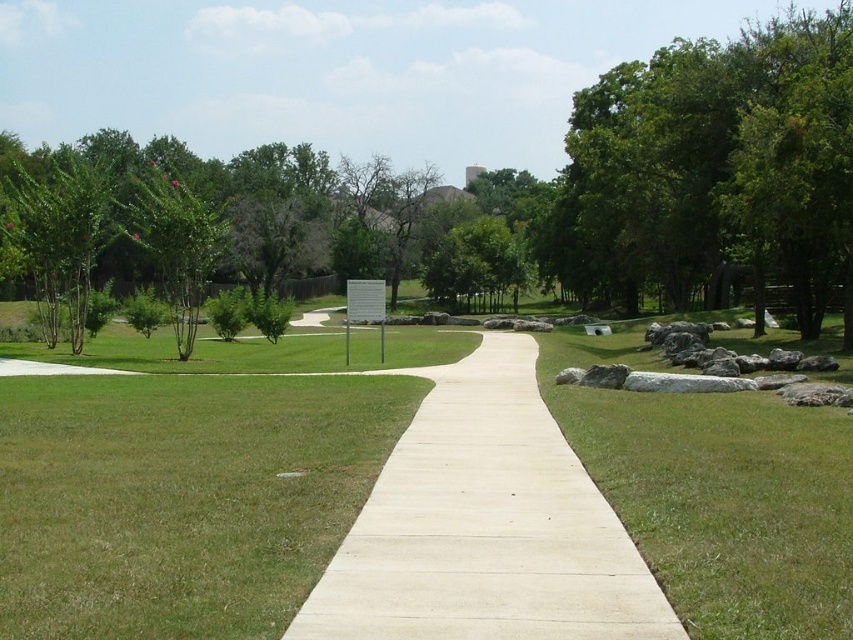
You are standing on the white concrete pavement at center and want to walk towards the green leafy tree at upper right. Which direction should you move to get closer to the tree?

You should move forward towards the green leafy tree at upper right because it is closer to you than the white concrete pavement at center.

You are standing on the paved pathway and want to walk towards the green leafy tree at upper right. Which direction should you turn to avoid the green leafy tree at left?

You should turn to the right to avoid the green leafy tree at left because the green leafy tree at upper right is to the right of the green leafy tree at left.

You are standing at the starting point of the white concrete path at center and the white concrete pavement at center. You want to walk to the end of both paths. Which path will require you to walk a shorter distance?

The white concrete pavement at center is closer to you than the white concrete path at center since the distance between them is 7.68 meters, so walking to the white concrete pavement at center requires a shorter distance.